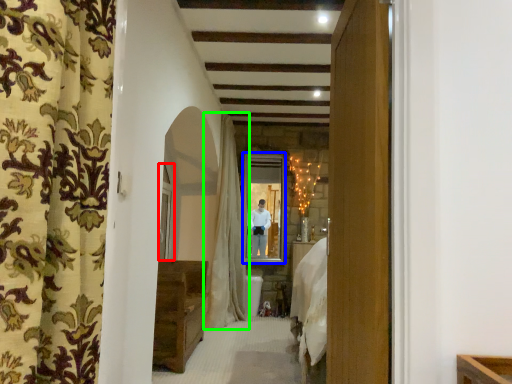
Question: Which object is positioned farthest from window (highlighted by a red box)? Select from window (highlighted by a blue box) and curtain (highlighted by a green box).

Choices:
 (A) window
 (B) curtain

Answer: (A)